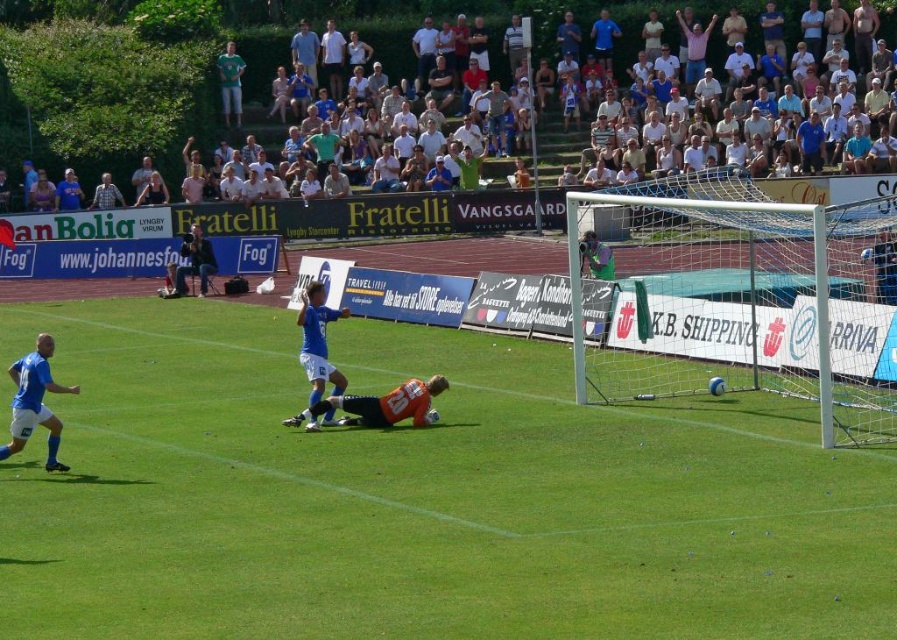
Is green grass football field at center below white plastic goal post at right?

Indeed, green grass football field at center is positioned under white plastic goal post at right.

Is green grass football field at center taller than white plastic goal post at right?

Incorrect, green grass football field at center's height is not larger of white plastic goal post at right's.

Does point (388, 566) lie in front of point (745, 268)?

Yes, point (388, 566) is in front of point (745, 268).

Identify the location of green grass football field at center. (417, 497).

Can you confirm if green grass football field at center is positioned to the left of white cotton crowd at upper center?

Correct, you'll find green grass football field at center to the left of white cotton crowd at upper center.

Is point (412, 432) closer to camera compared to point (9, 67)?

Yes, it is in front of point (9, 67).

Where is `green grass football field at center`? This screenshot has height=640, width=897. green grass football field at center is located at coordinates (417, 497).

I want to click on green grass football field at center, so tap(417, 497).

Does green grass football field at center have a lesser height compared to dark blue jacket at center?

In fact, green grass football field at center may be taller than dark blue jacket at center.

Who is positioned more to the left, green grass football field at center or dark blue jacket at center?

dark blue jacket at center is more to the left.

Does point (861, 570) come farther from viewer compared to point (205, 244)?

No, it is not.

Locate an element on the screen. green grass football field at center is located at coordinates (417, 497).